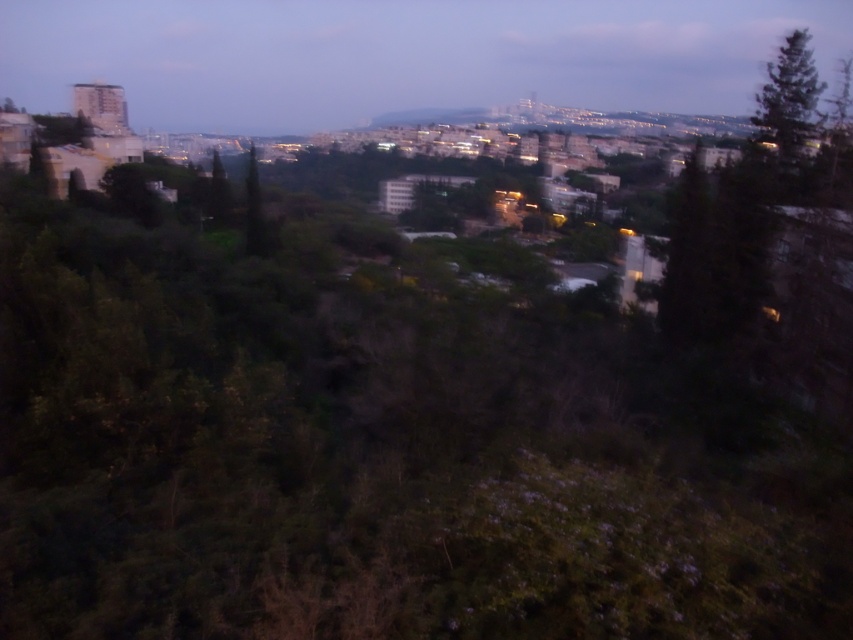
Question: Can you confirm if green textured tree at upper right is smaller than green leafy tree at center?

Choices:
 (A) no
 (B) yes

Answer: (B)

Question: Considering the relative positions of green textured tree at upper right and green leafy tree at center in the image provided, where is green textured tree at upper right located with respect to green leafy tree at center?

Choices:
 (A) right
 (B) left

Answer: (A)

Question: Does green textured tree at upper right have a greater width compared to green leafy tree at center?

Choices:
 (A) no
 (B) yes

Answer: (A)